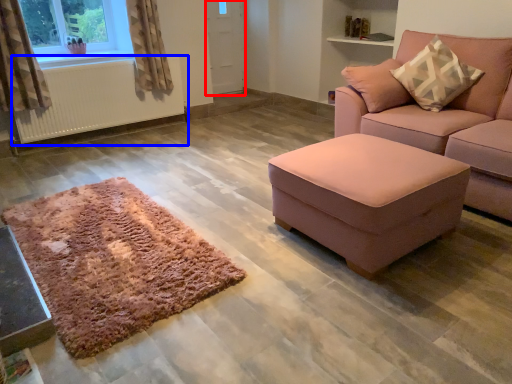
Question: Which object is closer to the camera taking this photo, screen door (highlighted by a red box) or radiator (highlighted by a blue box)?

Choices:
 (A) screen door
 (B) radiator

Answer: (B)